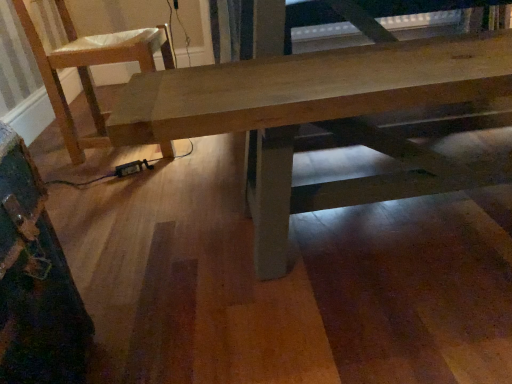
Question: Visually, is wooden table at center positioned to the left or to the right of light brown wood chair at upper left?

Choices:
 (A) right
 (B) left

Answer: (A)

Question: In the image, is wooden table at center positioned in front of or behind light brown wood chair at upper left?

Choices:
 (A) behind
 (B) front

Answer: (B)

Question: From a real-world perspective, relative to light brown wood chair at upper left, is wooden table at center vertically above or below?

Choices:
 (A) above
 (B) below

Answer: (B)

Question: Looking at their shapes, would you say light brown wood chair at upper left is wider or thinner than wooden table at center?

Choices:
 (A) wide
 (B) thin

Answer: (A)

Question: Does point click(89, 61) appear closer or farther from the camera than point click(232, 99)?

Choices:
 (A) farther
 (B) closer

Answer: (A)

Question: In the image, is light brown wood chair at upper left positioned in front of or behind wooden table at center?

Choices:
 (A) front
 (B) behind

Answer: (B)

Question: Is light brown wood chair at upper left bigger or smaller than wooden table at center?

Choices:
 (A) big
 (B) small

Answer: (B)